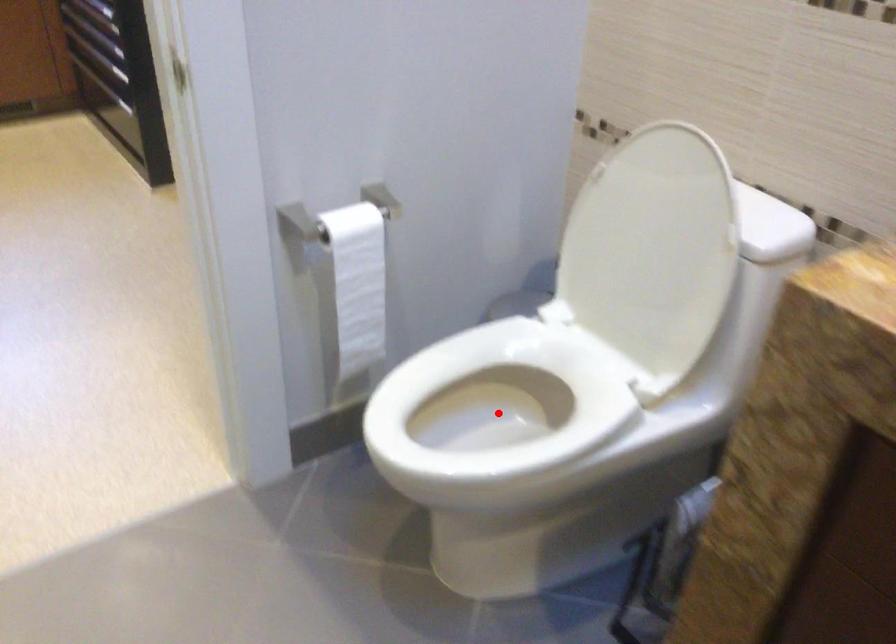
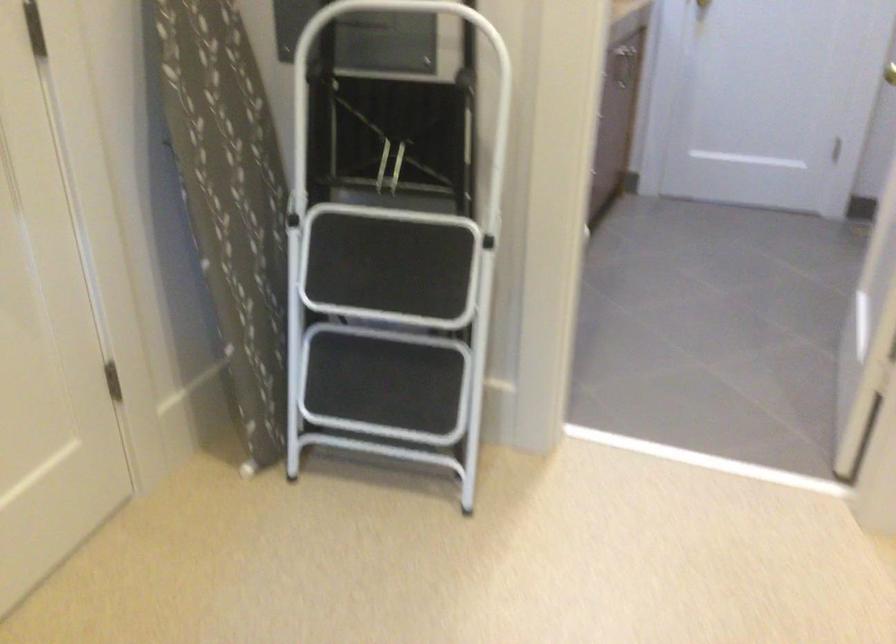
Question: I am providing you with two images of the same scene from different viewpoints. A red point is marked on the first image. Is the red point's position out of view in image 2?

Choices:
 (A) Yes
 (B) No

Answer: (A)